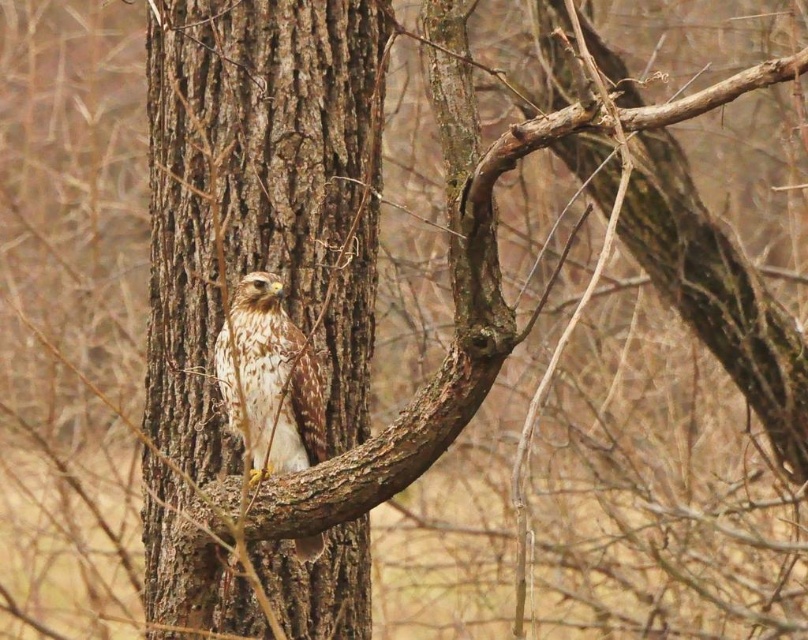
You are a photographer aiming to capture the hawk in the scene. You notice two points marked as point 1 at coordinates point (x=150, y=476) and point 2 at coordinates point (x=306, y=356). Which point is closer to the camera lens?

Point (x=306, y=356) is closer to the camera lens because point (x=150, y=476) is behind it.

You are a birdwatcher observing the brown rough bark tree trunk at center and the brown speckled feathers at center. Which object is taller in the image?

The brown rough bark tree trunk at center is taller than brown speckled feathers at center.

You are an ornithologist observing the brown rough bark tree trunk at center and the brown speckled feathers at center in the image. Which object is located more to the left?

The brown rough bark tree trunk at center is positioned on the left side of brown speckled feathers at center, so it is more to the left.